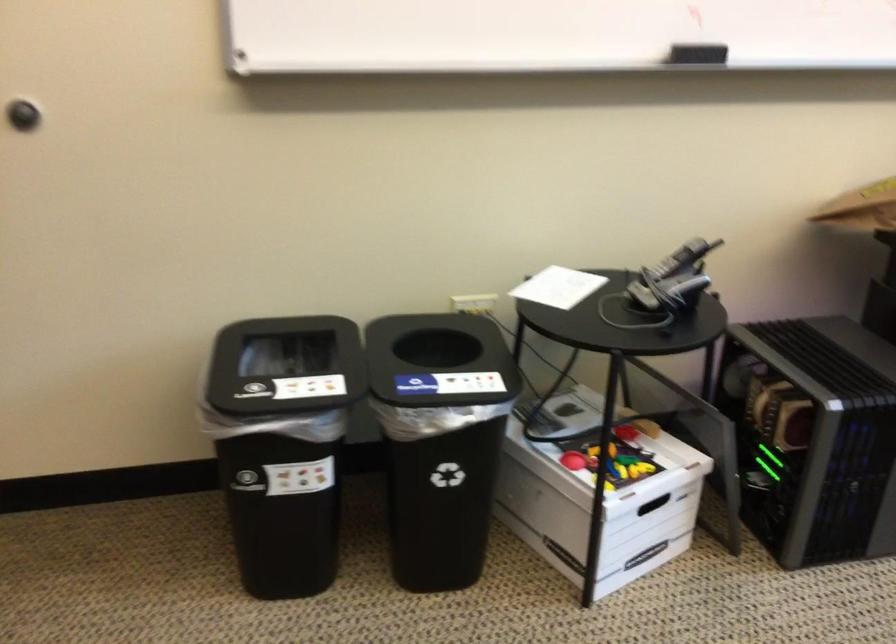
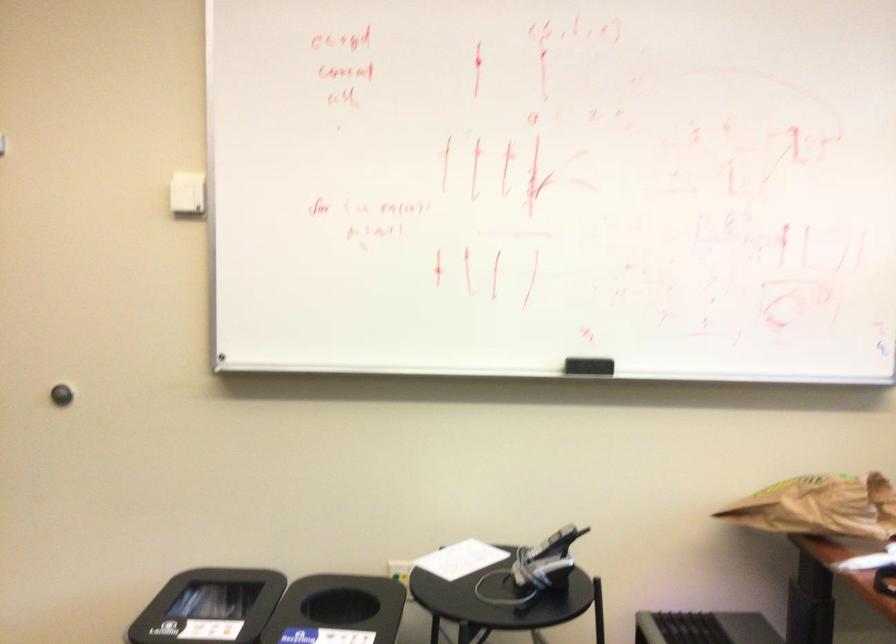
Where in the second image is the point corresponding to point 682,261 from the first image?

(552, 544)